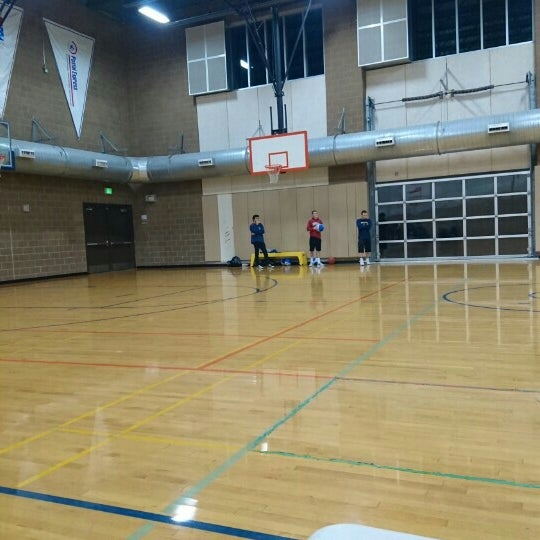
The image size is (540, 540). What are the coordinates of `yellow bench` in the screenshot? It's located at (294, 259).